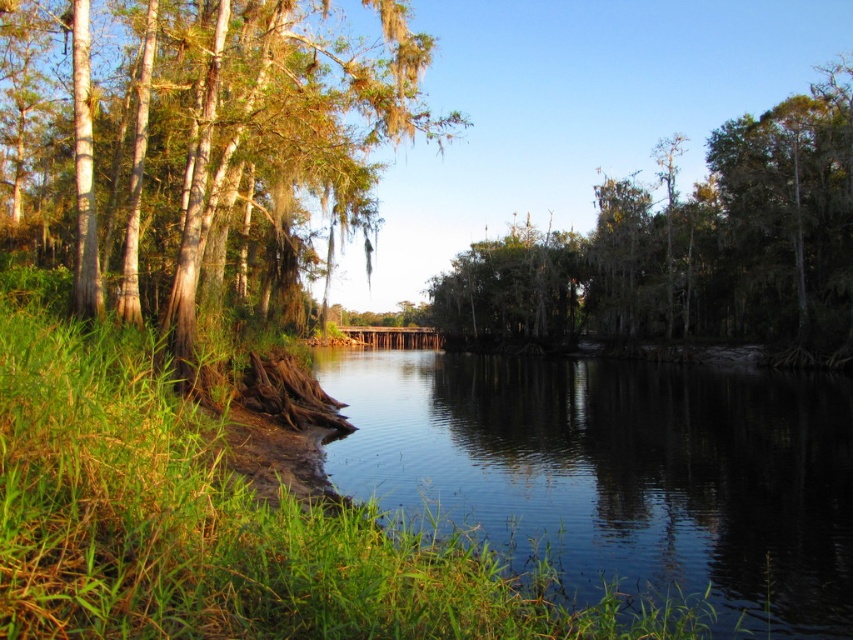
Question: Does green mossy tree at left appear over green mossy tree at center?

Choices:
 (A) yes
 (B) no

Answer: (A)

Question: Does green mossy tree at left lie behind green mossy tree at center?

Choices:
 (A) no
 (B) yes

Answer: (A)

Question: Among these objects, which one is nearest to the camera?

Choices:
 (A) green mossy tree at left
 (B) green mossy tree at center

Answer: (A)

Question: Which point appears farthest from the camera in this image?

Choices:
 (A) (779, 237)
 (B) (282, 225)
 (C) (759, 540)

Answer: (A)

Question: Which object is positioned closest to the clear water at center?

Choices:
 (A) green mossy tree at center
 (B) green mossy tree at left

Answer: (B)

Question: Where is clear water at center located in relation to green mossy tree at left in the image?

Choices:
 (A) below
 (B) above

Answer: (A)